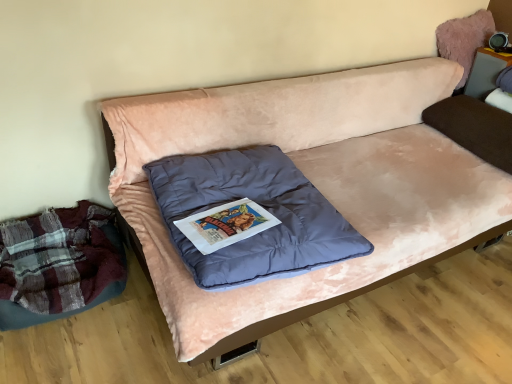
Question: Considering the relative positions of brown velvety pillow at right, the second pillow in the left-to-right sequence, and matte gray speaker at upper right in the image provided, is brown velvety pillow at right, the second pillow in the left-to-right sequence, to the left of matte gray speaker at upper right from the viewer's perspective?

Choices:
 (A) yes
 (B) no

Answer: (A)

Question: Considering the relative positions of brown velvety pillow at right, the first pillow when ordered from back to front, and matte gray speaker at upper right in the image provided, is brown velvety pillow at right, the first pillow when ordered from back to front, to the right of matte gray speaker at upper right from the viewer's perspective?

Choices:
 (A) yes
 (B) no

Answer: (B)

Question: Is brown velvety pillow at right, acting as the second pillow starting from the front, located outside matte gray speaker at upper right?

Choices:
 (A) yes
 (B) no

Answer: (A)

Question: Is brown velvety pillow at right, the first pillow when ordered from back to front, surrounding matte gray speaker at upper right?

Choices:
 (A) yes
 (B) no

Answer: (B)

Question: From a real-world perspective, is brown velvety pillow at right, the second pillow in the left-to-right sequence, on top of matte gray speaker at upper right?

Choices:
 (A) no
 (B) yes

Answer: (A)

Question: Is velvet pink couch at center in front of or behind fuzzy pink bean bag at upper right in the image?

Choices:
 (A) behind
 (B) front

Answer: (B)

Question: From the image's perspective, is velvet pink couch at center located above or below fuzzy pink bean bag at upper right?

Choices:
 (A) above
 (B) below

Answer: (B)

Question: Considering the positions of velvet pink couch at center and fuzzy pink bean bag at upper right in the image, is velvet pink couch at center bigger or smaller than fuzzy pink bean bag at upper right?

Choices:
 (A) small
 (B) big

Answer: (B)

Question: Is velvet pink couch at center to the left or to the right of fuzzy pink bean bag at upper right in the image?

Choices:
 (A) right
 (B) left

Answer: (B)

Question: From the image's perspective, is brown velvety pillow at right, acting as the second pillow starting from the front, above or below fuzzy pink bean bag at upper right?

Choices:
 (A) below
 (B) above

Answer: (A)

Question: Visually, is brown velvety pillow at right, the second pillow in the left-to-right sequence, positioned to the left or to the right of fuzzy pink bean bag at upper right?

Choices:
 (A) right
 (B) left

Answer: (B)

Question: From a real-world perspective, is brown velvety pillow at right, arranged as the 1th pillow when viewed from the right, positioned above or below fuzzy pink bean bag at upper right?

Choices:
 (A) below
 (B) above

Answer: (A)

Question: Does point (477, 104) appear closer or farther from the camera than point (485, 31)?

Choices:
 (A) closer
 (B) farther

Answer: (A)

Question: In terms of height, does brown velvety pillow at right, the second pillow in the left-to-right sequence, look taller or shorter compared to plaid fabric mattress at lower left?

Choices:
 (A) short
 (B) tall

Answer: (A)

Question: Is brown velvety pillow at right, acting as the second pillow starting from the front, wider or thinner than plaid fabric mattress at lower left?

Choices:
 (A) thin
 (B) wide

Answer: (B)